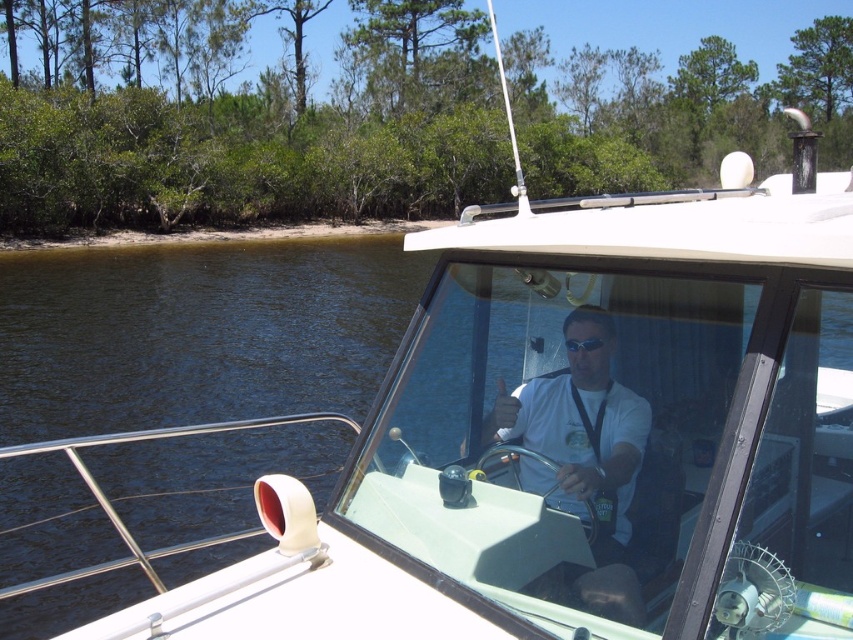
Question: Among these points, which one is farthest from the camera?

Choices:
 (A) (534, 420)
 (B) (601, 337)

Answer: (A)

Question: Which of the following is the farthest from the observer?

Choices:
 (A) white matte shirt at center
 (B) transparent plastic goggles at center

Answer: (B)

Question: Does white matte shirt at center come behind transparent plastic goggles at center?

Choices:
 (A) no
 (B) yes

Answer: (A)

Question: Is the position of white matte shirt at center more distant than that of transparent plastic goggles at center?

Choices:
 (A) no
 (B) yes

Answer: (A)

Question: Can you confirm if white matte shirt at center is bigger than transparent plastic goggles at center?

Choices:
 (A) yes
 (B) no

Answer: (A)